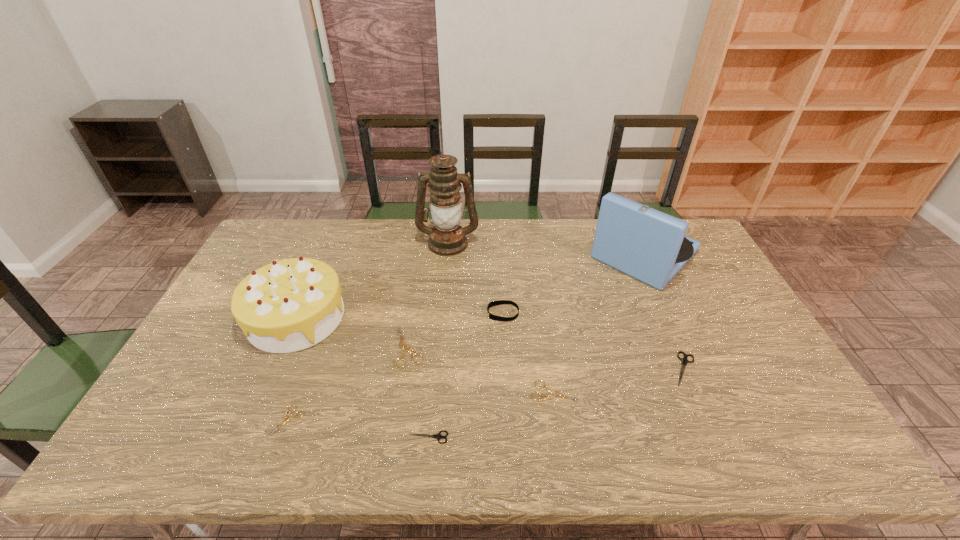
Find the location of `free space between the wristband and the rightmost shears`. free space between the wristband and the rightmost shears is located at coordinates (593, 341).

Where is `vacant space that is in between the left black shears and the second tallest object`? The image size is (960, 540). vacant space that is in between the left black shears and the second tallest object is located at coordinates (536, 346).

At what (x,y) coordinates should I click in order to perform the action: click on empty space that is in between the rightmost beige shears and the fourth object from right to left. Please return your answer as a coordinate pair (x, y). Looking at the image, I should click on (529, 352).

The image size is (960, 540). What are the coordinates of `empty location between the right black shears and the second nearest beige shears` in the screenshot? It's located at (619, 380).

Find the location of a particular element. Image resolution: width=960 pixels, height=540 pixels. blank region between the phonograph record and the sixth shortest object is located at coordinates (573, 284).

The width and height of the screenshot is (960, 540). I want to click on free space between the wristband and the birthday cake, so click(399, 315).

In order to click on object identified as the fifth closest to the second beige shears from right to left in this screenshot , I will do `click(553, 393)`.

Select which object appears as the third closest to the second farthest beige shears. Please provide its 2D coordinates. Your answer should be formatted as a tuple, i.e. [(x, y)], where the tuple contains the x and y coordinates of a point satisfying the conditions above.

[(684, 360)]

Image resolution: width=960 pixels, height=540 pixels. I want to click on shears identified as the third closest to the rightmost beige shears, so click(403, 347).

Identify the location of the closest shears relative to the second beige shears from left to right. This screenshot has width=960, height=540. (438, 436).